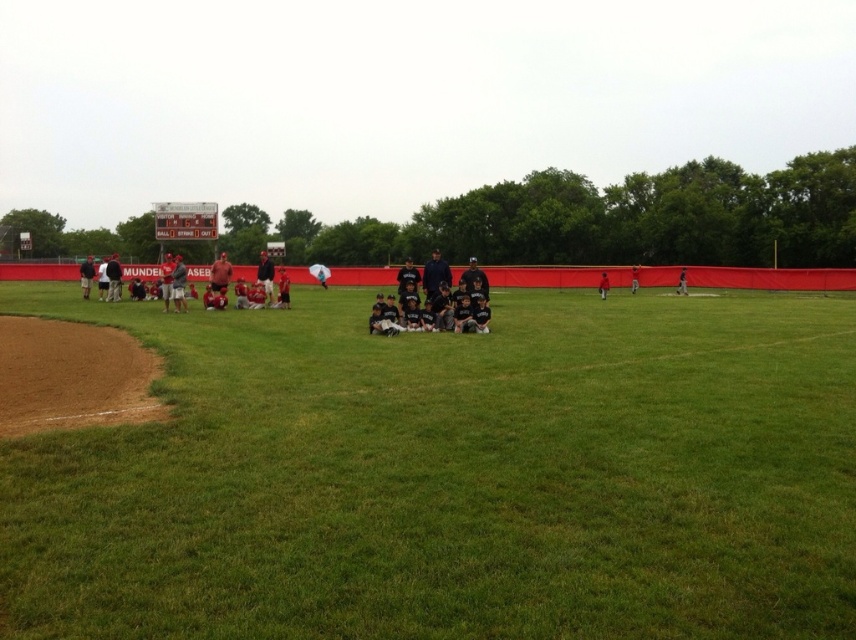
You are a photographer setting up for a group photo at the baseball field. You notice the green grass at center and the blue fabric jacket at center. Which object is shorter in height?

The green grass at center is shorter in height compared to the blue fabric jacket at center.

Consider the image. You are a photographer taking a picture of the matte red baseball caps at center and the blue fabric jacket at center. Which object is positioned higher in the frame?

Result: The matte red baseball caps at center is above the blue fabric jacket at center in the frame.

You are a photographer standing behind the group of people in the middle. You want to capture a photo that includes both the green grass at center and the blue fabric jacket at center. Which object will appear larger in your photo?

The green grass at center will appear larger in the photo because it is closer to the viewer than the blue fabric jacket at center.